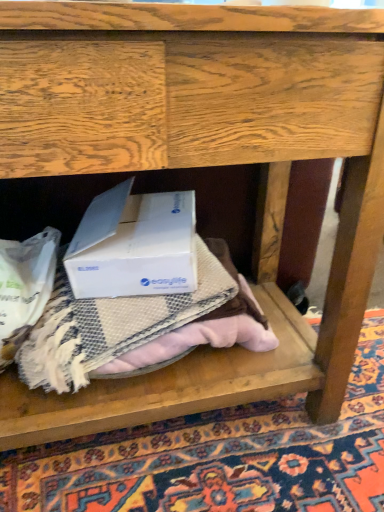
Question: Considering the relative sizes of beige textured mat at center and white cardboard box at center in the image provided, is beige textured mat at center smaller than white cardboard box at center?

Choices:
 (A) no
 (B) yes

Answer: (A)

Question: Can you confirm if beige textured mat at center is positioned to the right of white cardboard box at center?

Choices:
 (A) no
 (B) yes

Answer: (B)

Question: Is beige textured mat at center located outside white cardboard box at center?

Choices:
 (A) no
 (B) yes

Answer: (B)

Question: From a real-world perspective, is beige textured mat at center on top of white cardboard box at center?

Choices:
 (A) no
 (B) yes

Answer: (A)

Question: From the image's perspective, is beige textured mat at center below white cardboard box at center?

Choices:
 (A) no
 (B) yes

Answer: (B)

Question: Is beige textured mat at center positioned with its back to white cardboard box at center?

Choices:
 (A) no
 (B) yes

Answer: (A)

Question: From a real-world perspective, does beige textured blanket at center stand above beige textured mat at center?

Choices:
 (A) yes
 (B) no

Answer: (A)

Question: Is beige textured blanket at center completely or partially outside of beige textured mat at center?

Choices:
 (A) yes
 (B) no

Answer: (A)

Question: Could you tell me if beige textured blanket at center is turned towards beige textured mat at center?

Choices:
 (A) no
 (B) yes

Answer: (A)

Question: Is beige textured blanket at center closer to the viewer compared to beige textured mat at center?

Choices:
 (A) yes
 (B) no

Answer: (B)

Question: From the image's perspective, is beige textured blanket at center under beige textured mat at center?

Choices:
 (A) yes
 (B) no

Answer: (A)

Question: Is beige textured blanket at center not close to beige textured mat at center?

Choices:
 (A) yes
 (B) no

Answer: (B)

Question: Is white cardboard box at center oriented away from beige textured mat at center?

Choices:
 (A) yes
 (B) no

Answer: (B)